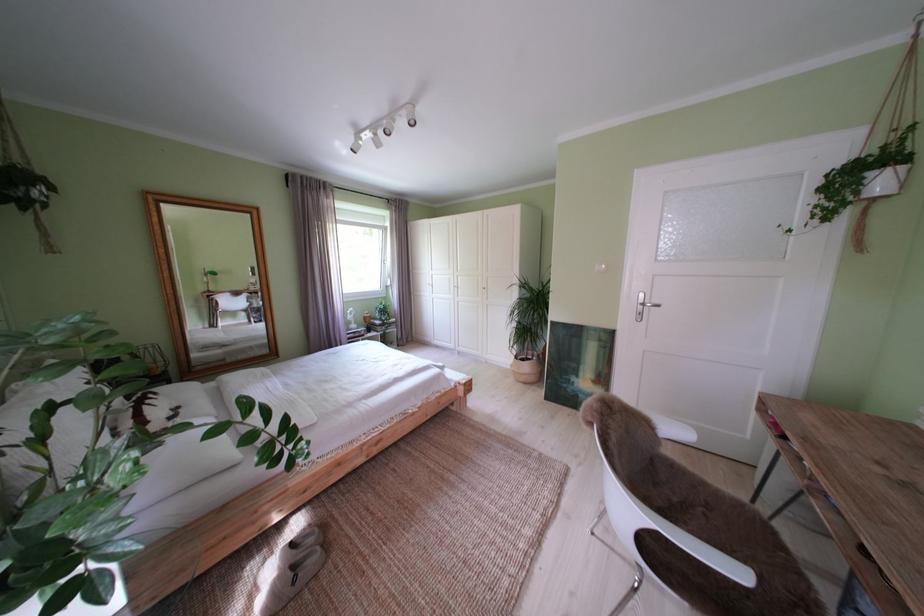
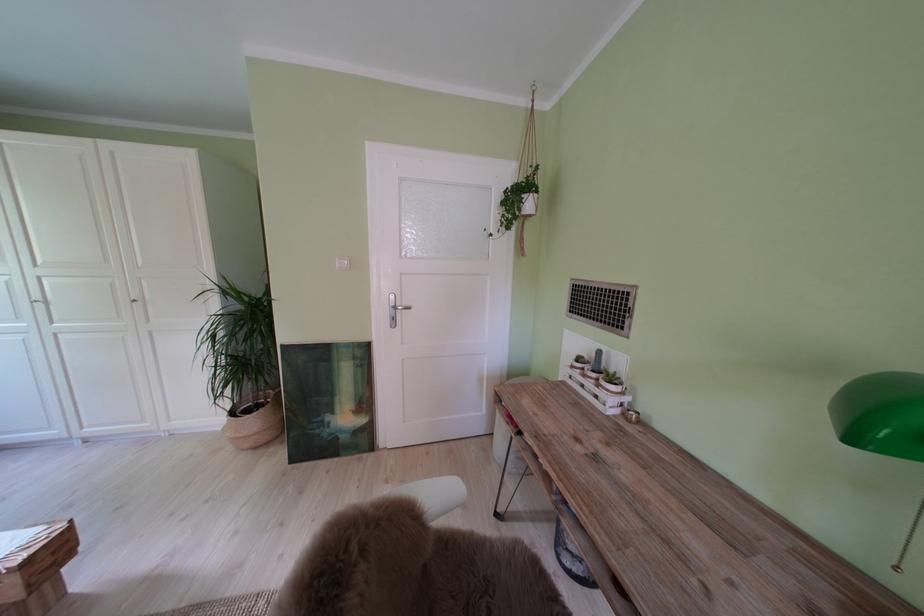
Where in the second image is the point corresponding to point 576,391 from the first image?

(329, 437)